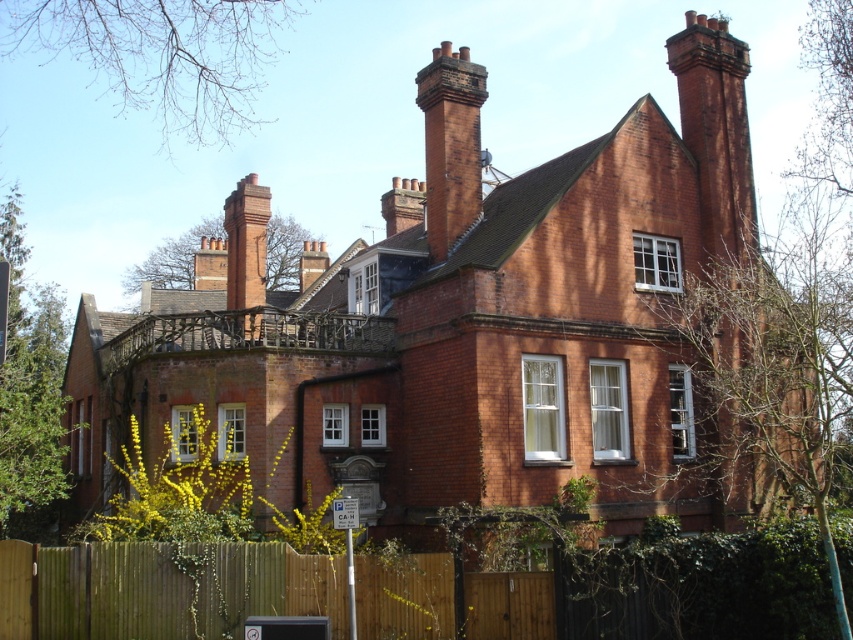
Does brown wooden fence at lower center have a greater width compared to red brick chimney at upper center?

Correct, the width of brown wooden fence at lower center exceeds that of red brick chimney at upper center.

Does brown wooden fence at lower center appear on the left side of red brick chimney at upper center?

Indeed, brown wooden fence at lower center is positioned on the left side of red brick chimney at upper center.

Is point (386, 577) closer to camera compared to point (434, 147)?

Yes, point (386, 577) is in front of point (434, 147).

Locate an element on the screen. brown wooden fence at lower center is located at coordinates (161, 588).

Who is lower down, red brick chimney at upper center or red brick chimney at upper left?

red brick chimney at upper left is lower down.

Which is behind, point (479, 198) or point (227, 205)?

The point (227, 205) is more distant.

Where is `red brick chimney at upper center`? red brick chimney at upper center is located at coordinates (450, 145).

Is point (119, 556) positioned behind point (257, 236)?

No.

Between point (432, 566) and point (247, 176), which one is positioned behind?

Point (247, 176)

Is point (447, 609) in front of point (267, 195)?

Yes.

The height and width of the screenshot is (640, 853). In order to click on brown wooden fence at lower center in this screenshot , I will do `click(161, 588)`.